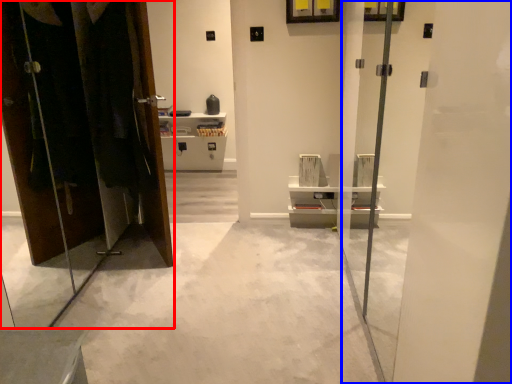
Question: Among these objects, which one is farthest to the camera, dresser (highlighted by a red box) or screen door (highlighted by a blue box)?

Choices:
 (A) dresser
 (B) screen door

Answer: (A)